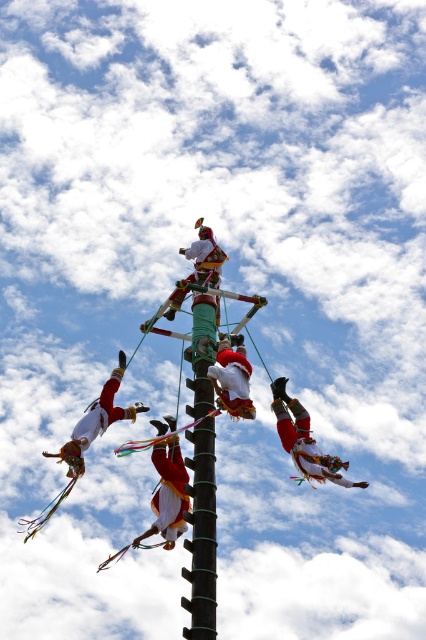
From the picture: Between red velvet ribbon at center and white cotton pants at center, which one is positioned lower?

red velvet ribbon at center

Between point (284, 385) and point (216, 371), which one is positioned behind?

Point (284, 385)

Where is `red velvet ribbon at center`? The height and width of the screenshot is (640, 426). red velvet ribbon at center is located at coordinates (304, 440).

Can you confirm if white cotton fabric at center is thinner than red velvet ribbon at center?

Correct, white cotton fabric at center's width is less than red velvet ribbon at center's.

Looking at this image, which is below, white cotton fabric at center or red velvet ribbon at center?

white cotton fabric at center is below.

At what (x,y) coordinates should I click in order to perform the action: click on white cotton fabric at center. Please return your answer as a coordinate pair (x, y). The height and width of the screenshot is (640, 426). Looking at the image, I should click on (167, 492).

Looking at this image, is red velvet ribbon at center to the left of white fabric dancer at lower left from the viewer's perspective?

Incorrect, red velvet ribbon at center is not on the left side of white fabric dancer at lower left.

Does point (330, 461) lie behind point (98, 432)?

No.

The height and width of the screenshot is (640, 426). I want to click on red velvet ribbon at center, so click(304, 440).